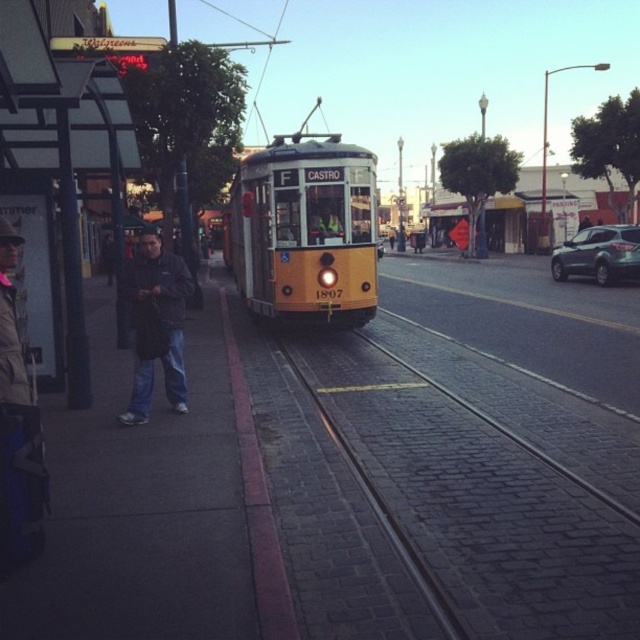
You are a pedestrian on the sidewalk and want to know which jacket is closer to you. You see a denim jacket at left and a dark blue jacket at left. Which one is closer?

The denim jacket at left is closer to you because it is positioned under the dark blue jacket at left, meaning it is in front of the dark blue jacket.

You are a delivery person needing to place a package on the sidewalk near the denim jacket at left. The sidewalk is 1.2 meters wide. Can you estimate if the package, which is 0.5 meters wide, will fit on the sidewalk without exceeding its width?

The denim jacket at left is located at point (17, 429), which indicates its position on the sidewalk. Since the sidewalk is 1.2 meters wide and the package is only 0.5 meters wide, there is sufficient space for the package to fit without exceeding the sidewalk width.